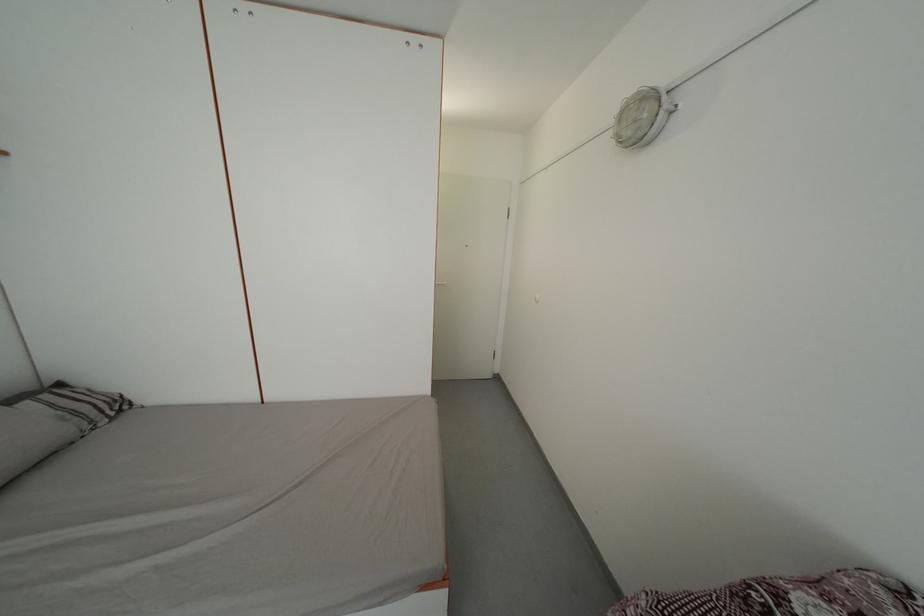
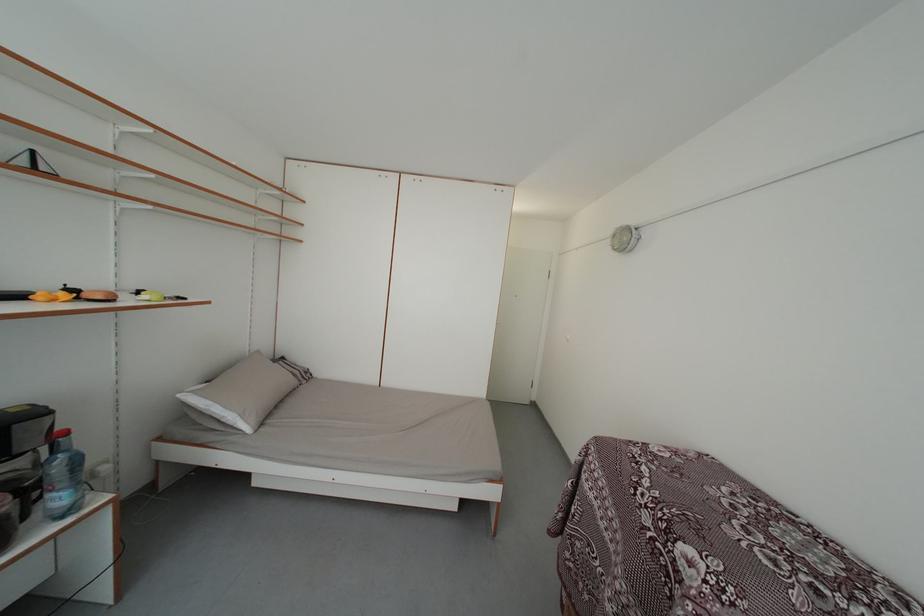
Locate, in the second image, the point that corresponds to (x=66, y=391) in the first image.

(289, 365)